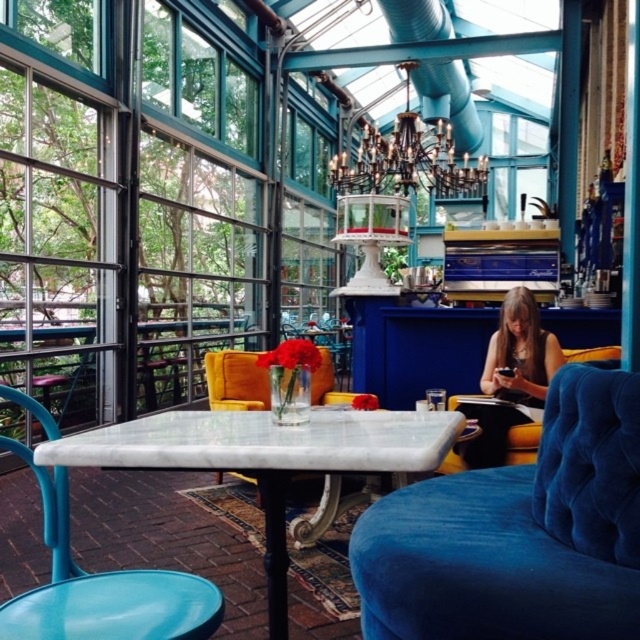
You are standing in the cozy and stylish cafe and want to take a photo of both the plush blue velvet bench and the marble top table with the turquoise metal chair. Since you are using a wide angle lens, you need to know which of the two points, point (152, 584) or point (248, 365), is closer to you to ensure proper focus. Which point should you focus on?

You should focus on point (152, 584) because it is closer to the camera than point (248, 365).

In the scene shown: You are a customer entering the cozy and stylish cafe and want to sit at the closest available seat. The cafe has a plush blue velvet bench in the foreground and a matte blue armchair at center. Which seat is closer to you?

The plush blue velvet bench in the foreground is closer to you because it is mentioned as being in the foreground, while the matte blue armchair at center is located further back at coordinates point (100, 586).

Based on the photo, you are a customer entering the cozy and stylish cafe and want to sit in a place where you can see both the matte blue armchair at center and the smooth brown hair at right. Which seat would allow you to have a better view of both objects?

The smooth brown hair at right is taller than the matte blue armchair at center, so sitting in a seat that is positioned behind or to the side of both objects would provide a better view of both. However, since the smooth brown hair at right is taller, you might need to position yourself where its height doesn